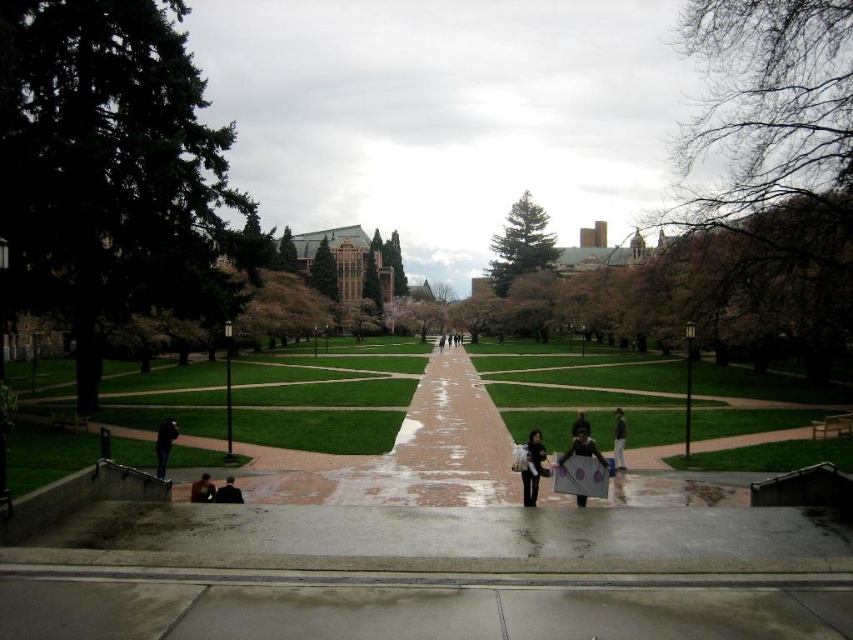
Can you confirm if dark blue jeans at lower left is shorter than dark blue jacket at lower left?

No, dark blue jeans at lower left is not shorter than dark blue jacket at lower left.

Identify the location of dark blue jeans at lower left. The height and width of the screenshot is (640, 853). (164, 444).

Can you confirm if black fabric bag at center is positioned below dark brown leather jacket at center?

Actually, black fabric bag at center is above dark brown leather jacket at center.

Is black fabric bag at center thinner than dark brown leather jacket at center?

Yes.

Measure the distance between point (538,476) and camera.

Point (538,476) is 20.48 meters away from camera.

Locate an element on the screen. This screenshot has height=640, width=853. black fabric bag at center is located at coordinates (532, 467).

Is black fabric bag at center above dark gray jacket at center?

Yes, black fabric bag at center is above dark gray jacket at center.

Which is above, black fabric bag at center or dark gray jacket at center?

black fabric bag at center is above.

Does point (529, 484) come in front of point (614, 460)?

That is True.

The width and height of the screenshot is (853, 640). I want to click on black fabric bag at center, so click(x=532, y=467).